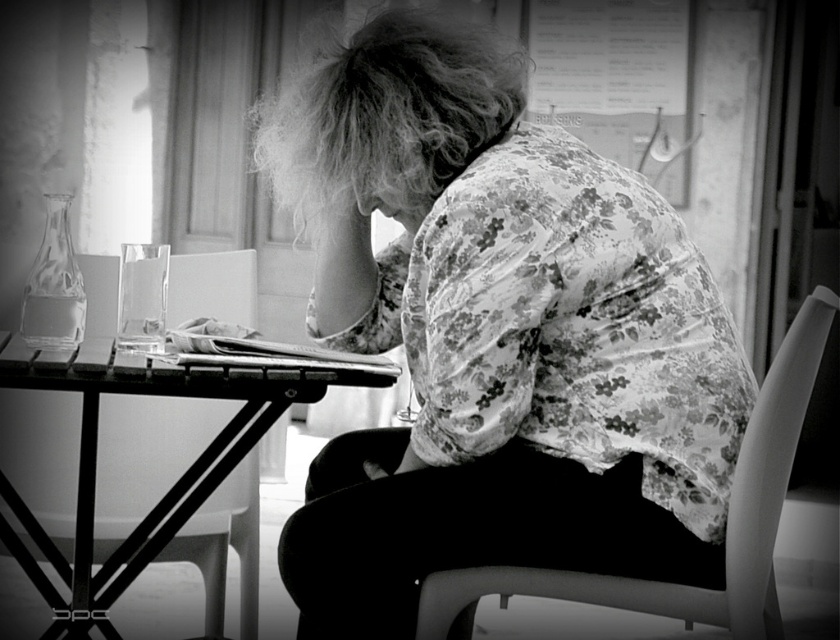
Consider the image. You are a photographer adjusting your camera to capture the scene. You notice the metallic table at center and the smooth skin hand at center. Which object is located to the left of the other?

The metallic table at center is positioned on the left side of smooth skin hand at center.

You are a photographer trying to capture a portrait of the person with their fluffy hair at center and metallic table at center. Which object should you focus on first if you want to ensure both are in sharp focus?

The metallic table at center is thicker than fluffy hair at center, so you should focus on the metallic table at center first to ensure both are in sharp focus.